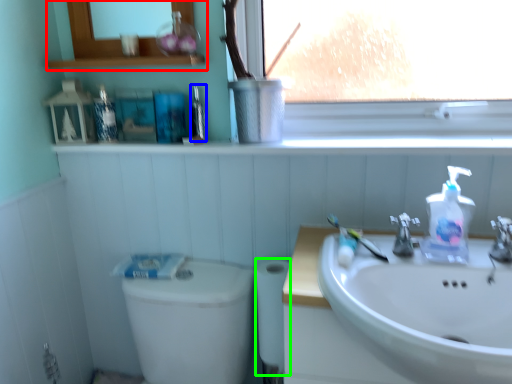
Question: Which object is positioned closest to medicine cabinet (highlighted by a red box)? Select from mouthwash (highlighted by a blue box) and toilet paper (highlighted by a green box).

Choices:
 (A) mouthwash
 (B) toilet paper

Answer: (A)